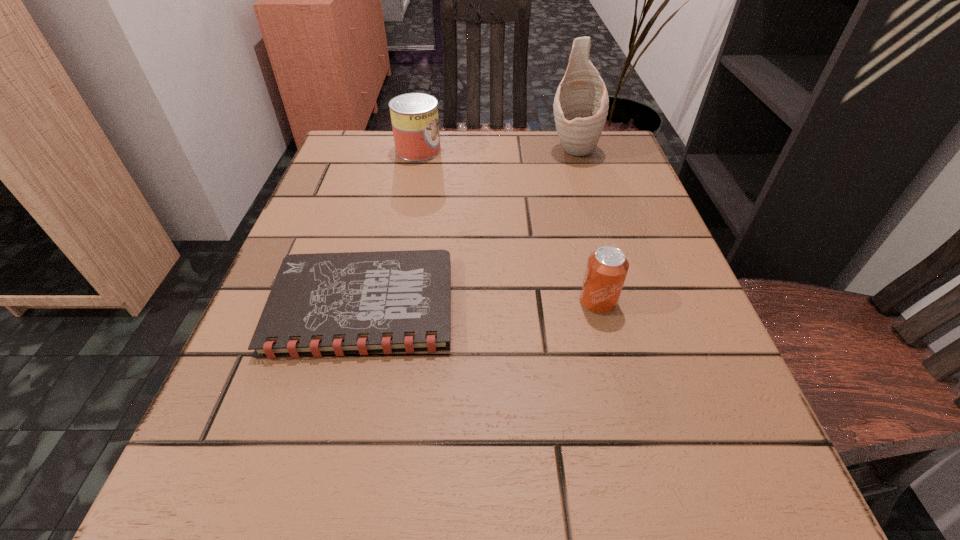
Identify the location of vacant point located between the shortest object and the farther can. (391, 227).

Where is `free space between the tallest object and the notebook`? The height and width of the screenshot is (540, 960). free space between the tallest object and the notebook is located at coordinates (468, 227).

Where is `vacant area between the nearer can and the shortest object`? Image resolution: width=960 pixels, height=540 pixels. vacant area between the nearer can and the shortest object is located at coordinates (480, 303).

Select which object is the closest to the left can. Please provide its 2D coordinates. Your answer should be formatted as a tuple, i.e. [(x, y)], where the tuple contains the x and y coordinates of a point satisfying the conditions above.

[(581, 103)]

Select which object appears as the closest to the farther can. Please provide its 2D coordinates. Your answer should be formatted as a tuple, i.e. [(x, y)], where the tuple contains the x and y coordinates of a point satisfying the conditions above.

[(581, 103)]

I want to click on blank area in the image that satisfies the following two spatial constraints: 1. on the back side of the notebook; 2. on the left side of the farther can, so click(x=401, y=150).